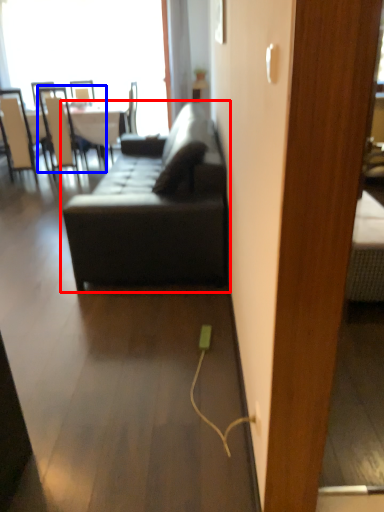
Question: Which object appears farthest to the camera in this image, studio couch (highlighted by a red box) or chair (highlighted by a blue box)?

Choices:
 (A) studio couch
 (B) chair

Answer: (B)